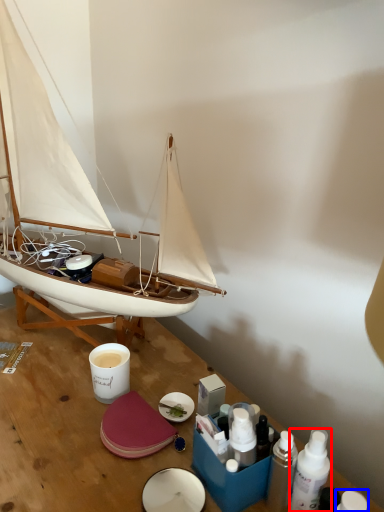
Question: Which of the following is the farthest to the observer, toiletry (highlighted by a red box) or toiletry (highlighted by a blue box)?

Choices:
 (A) toiletry
 (B) toiletry

Answer: (A)